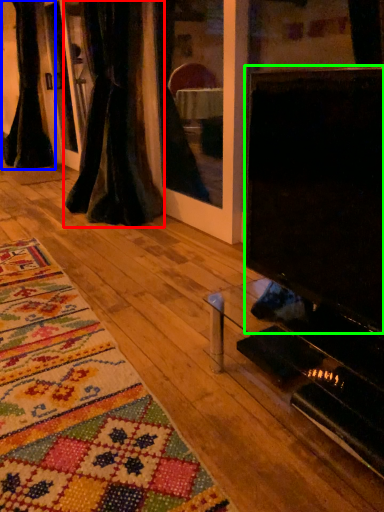
Question: Which object is positioned farthest from curtain (highlighted by a red box)? Select from curtain (highlighted by a blue box) and screen (highlighted by a green box).

Choices:
 (A) curtain
 (B) screen

Answer: (B)